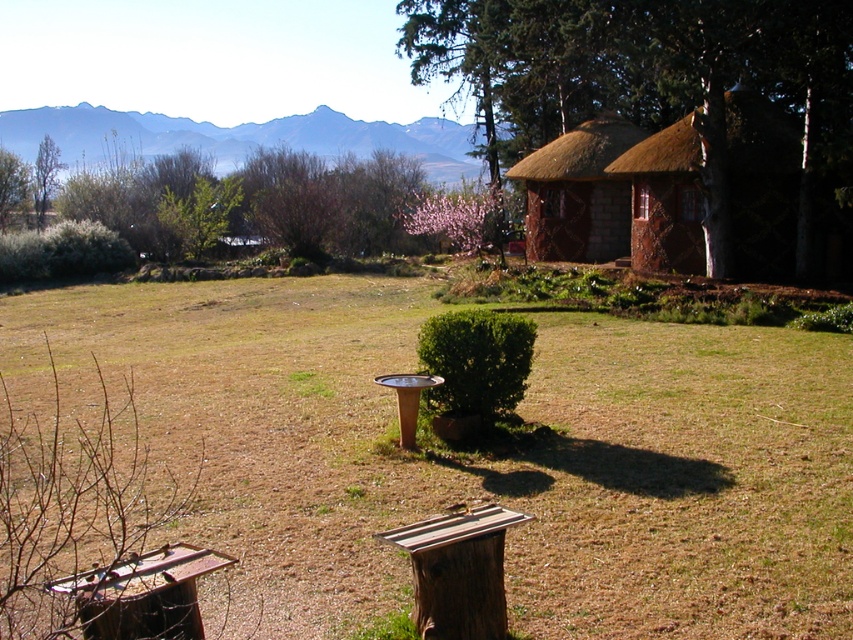
Who is positioned more to the left, brown wooden bird bath at center or thatched wood hut at right?

brown wooden bird bath at center

Is brown wooden bird bath at center behind thatched wood hut at right?

No, brown wooden bird bath at center is in front of thatched wood hut at right.

Is point (73, 307) positioned after point (769, 237)?

Yes, point (73, 307) is behind point (769, 237).

The height and width of the screenshot is (640, 853). I want to click on brown wooden bird bath at center, so click(x=479, y=456).

Is point (358, 460) positioned behind point (430, 561)?

Yes, point (358, 460) is behind point (430, 561).

Which is behind, point (793, 604) or point (426, 548)?

Point (793, 604)

This screenshot has height=640, width=853. What are the coordinates of `brown wooden bird bath at center` in the screenshot? It's located at (479, 456).

Is brown wooden bird bath at center to the left of brown thatch hut at center from the viewer's perspective?

Correct, you'll find brown wooden bird bath at center to the left of brown thatch hut at center.

Does brown wooden bird bath at center have a greater width compared to brown thatch hut at center?

Yes.

This screenshot has width=853, height=640. I want to click on brown wooden bird bath at center, so click(x=479, y=456).